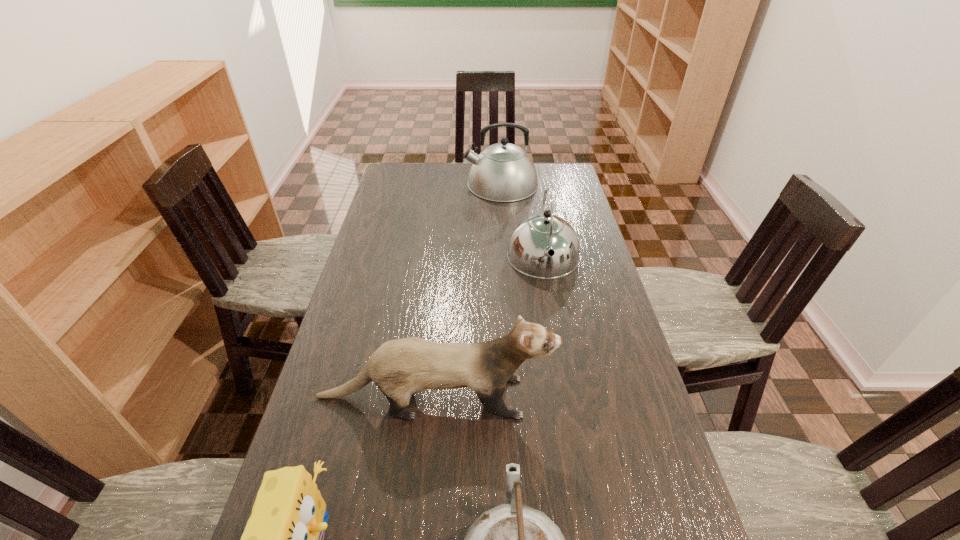
Where is `the farthest object`? This screenshot has height=540, width=960. the farthest object is located at coordinates (503, 172).

At what (x,y) coordinates should I click in order to perform the action: click on the third nearest object. Please return your answer as a coordinate pair (x, y). This screenshot has width=960, height=540. Looking at the image, I should click on (401, 367).

The height and width of the screenshot is (540, 960). In order to click on the fourth nearest object in this screenshot , I will do `click(532, 239)`.

You are a GUI agent. You are given a task and a screenshot of the screen. Output one action in this format:
    pyautogui.click(x=<x>, y=<y>)
    Task: Click on the free space located 0.160m from the spout of the farthest kettle
    
    Given the screenshot: What is the action you would take?
    pyautogui.click(x=427, y=184)

At what (x,y) coordinates should I click in order to perform the action: click on free point located 0.350m from the spout of the farthest kettle. Please return your answer as a coordinate pair (x, y). Looking at the image, I should click on (383, 184).

What are the coordinates of `free space located from the spout of the farthest kettle` in the screenshot? It's located at (414, 184).

Where is `vacant space situated 0.090m on the face of the third nearest object`? Image resolution: width=960 pixels, height=540 pixels. vacant space situated 0.090m on the face of the third nearest object is located at coordinates (588, 397).

The width and height of the screenshot is (960, 540). I want to click on vacant space located 0.310m from the spout of the second farthest object, so click(562, 362).

Locate an element on the screen. This screenshot has width=960, height=540. object present at the far edge is located at coordinates (503, 172).

Image resolution: width=960 pixels, height=540 pixels. Identify the location of object present at the left edge. click(401, 367).